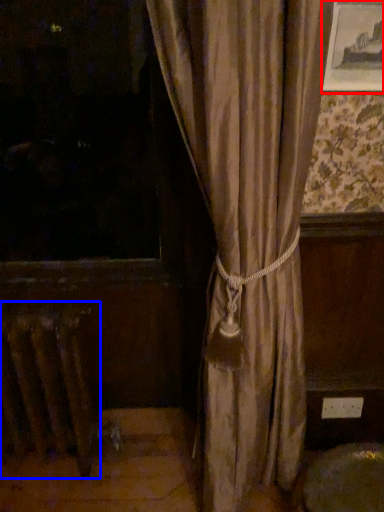
Question: Which object is closer to the camera taking this photo, picture frame (highlighted by a red box) or radiator (highlighted by a blue box)?

Choices:
 (A) picture frame
 (B) radiator

Answer: (A)